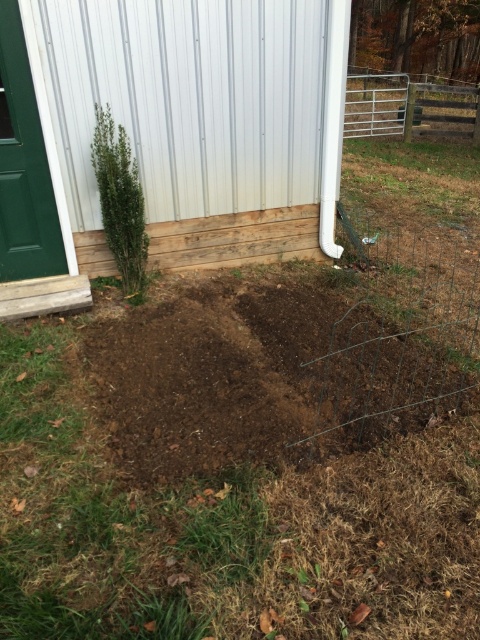
You are planning to plant a new flower in the backyard. You have a flower pot that is 20 cm wide. Can the dark brown soil at center accommodate the flower pot without overlapping the green leafy plant at left?

The dark brown soil at center is wider than the green leafy plant at left, so the flower pot can be placed in the dark brown soil at center without overlapping the plant as there is enough space.

You are standing in the backyard and want to place a small garden sign between the two points labeled point [344,116] and point [107,163]. Based on their positions, which point is closer to you where you should start digging?

Point [107,163] is closer to you, so you should start digging near that point first.